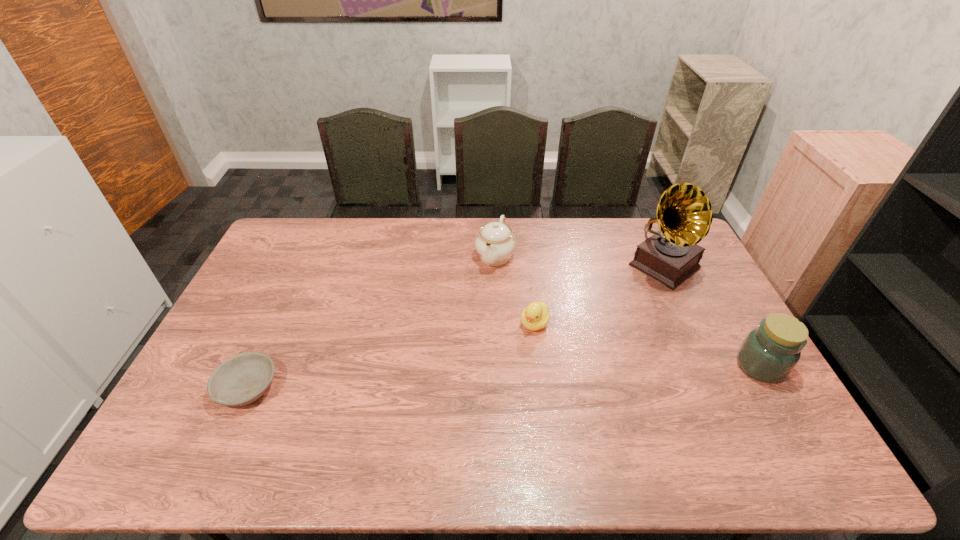
Locate an element on the screen. The image size is (960, 540). vacant area between the duckling and the chinaware is located at coordinates (515, 289).

In order to click on object that is the nearest to the jar in this screenshot , I will do `click(671, 255)`.

Find the location of `object that is the fourth closest to the bowl`. object that is the fourth closest to the bowl is located at coordinates 769,353.

Where is `vacant space that satisfies the following two spatial constraints: 1. on the back side of the duckling; 2. on the left side of the tallest object`? The height and width of the screenshot is (540, 960). vacant space that satisfies the following two spatial constraints: 1. on the back side of the duckling; 2. on the left side of the tallest object is located at coordinates (528, 267).